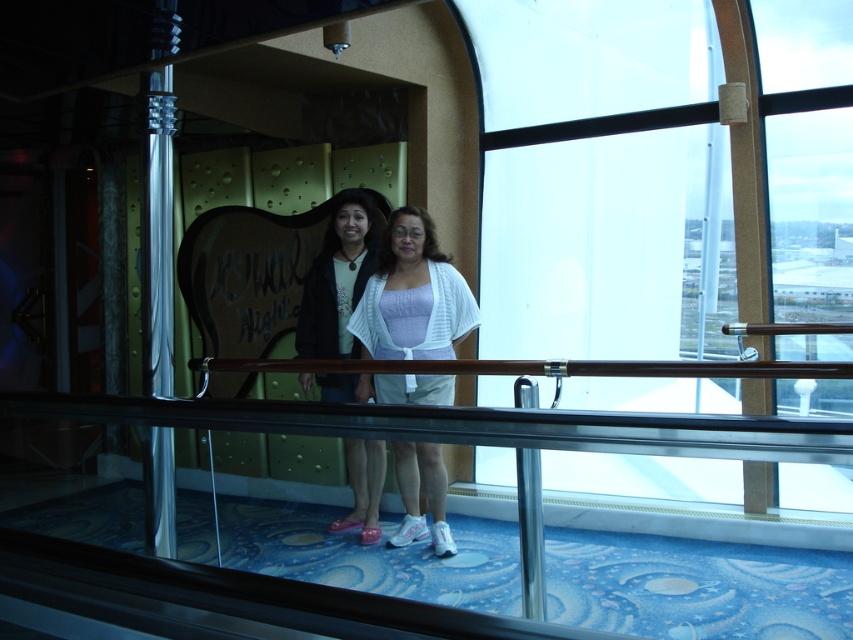
Question: Can you confirm if white knit cardigan at center is smaller than matte black jacket at center?

Choices:
 (A) no
 (B) yes

Answer: (A)

Question: Does white knit cardigan at center have a larger size compared to matte black jacket at center?

Choices:
 (A) yes
 (B) no

Answer: (A)

Question: Does white knit cardigan at center have a lesser width compared to matte black jacket at center?

Choices:
 (A) yes
 (B) no

Answer: (B)